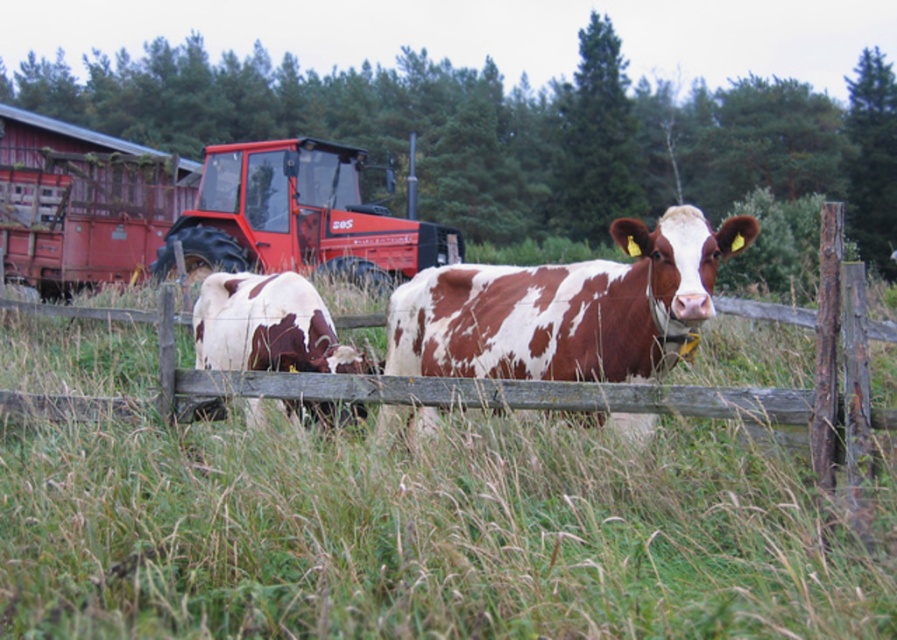
Does brown and white speckled cow at center have a greater height compared to wooden fence at center?

Indeed, brown and white speckled cow at center has a greater height compared to wooden fence at center.

Which is behind, point (665, 248) or point (116, 316)?

Point (116, 316)

This screenshot has width=897, height=640. In order to click on brown and white speckled cow at center in this screenshot , I will do pos(567,308).

Locate an element on the screen. The image size is (897, 640). brown and white speckled cow at center is located at coordinates tap(567, 308).

Does wooden fence at center have a greater width compared to metallic red tractor at center?

No, wooden fence at center is not wider than metallic red tractor at center.

Can you confirm if wooden fence at center is smaller than metallic red tractor at center?

Correct, wooden fence at center occupies less space than metallic red tractor at center.

What do you see at coordinates (584, 384) in the screenshot? I see `wooden fence at center` at bounding box center [584, 384].

I want to click on wooden fence at center, so click(x=584, y=384).

Is brown and white speckled cow at center shorter than brown spotted fur at center?

Incorrect, brown and white speckled cow at center's height does not fall short of brown spotted fur at center's.

Does point (547, 305) come closer to viewer compared to point (293, 285)?

That is True.

In order to click on brown and white speckled cow at center in this screenshot , I will do `click(567, 308)`.